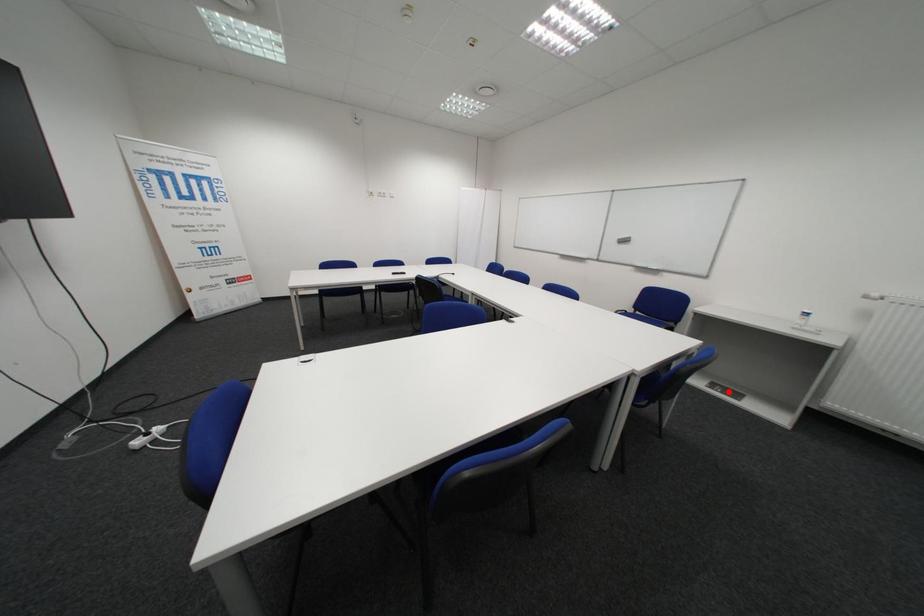
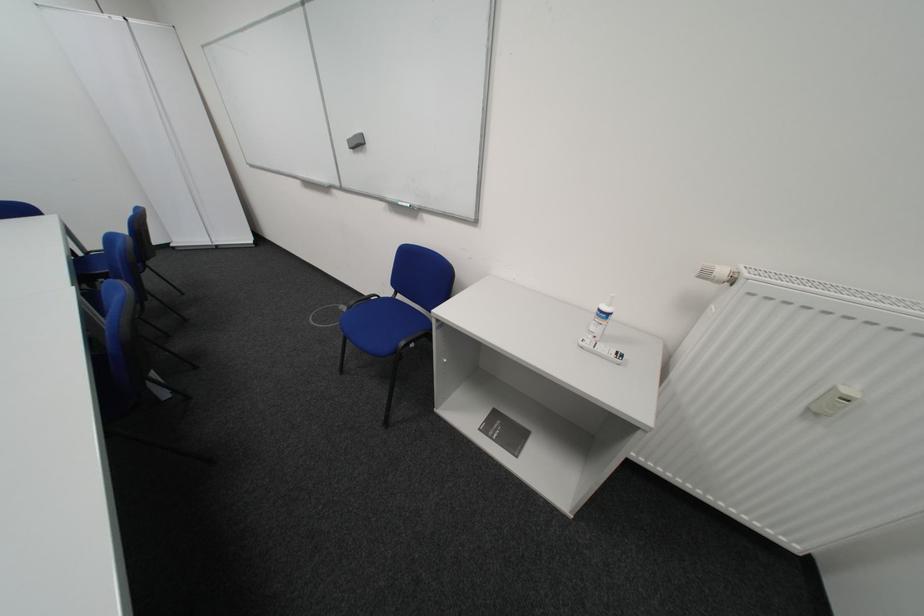
Question: A red point is marked in image1. In image2, is the corresponding 3D point closer to the camera or farther? Reply with the corresponding letter.

Choices:
 (A) The corresponding 3D point is closer.
 (B) The corresponding 3D point is farther.

Answer: (A)